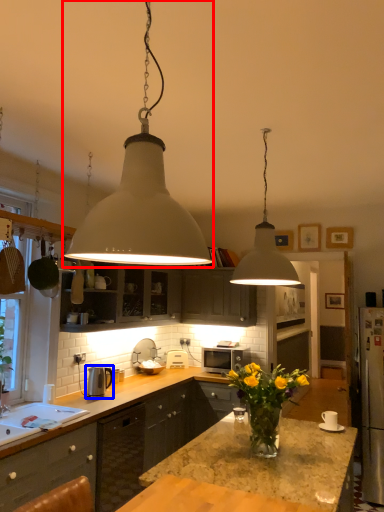
Question: Which object is closer to the camera taking this photo, lamp (highlighted by a red box) or appliance (highlighted by a blue box)?

Choices:
 (A) lamp
 (B) appliance

Answer: (A)